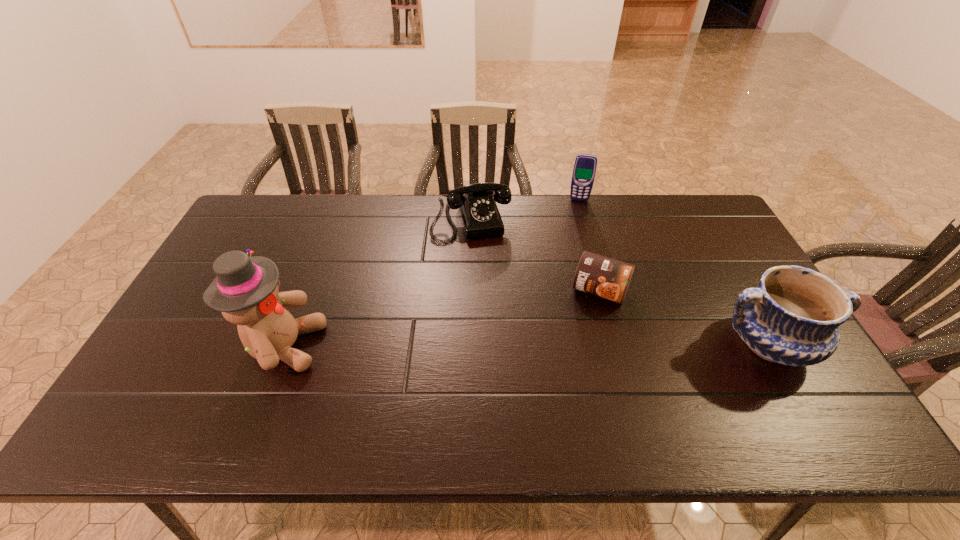
This screenshot has height=540, width=960. What are the coordinates of `free space located 0.100m on the front label of the can` in the screenshot? It's located at (581, 336).

Find the location of `vacant position located on the front label of the can`. vacant position located on the front label of the can is located at coordinates (583, 330).

Find the location of `free location located on the front-facing side of the cellular telephone`. free location located on the front-facing side of the cellular telephone is located at coordinates (573, 237).

Image resolution: width=960 pixels, height=540 pixels. Identify the location of blank area located on the front-facing side of the cellular telephone. coord(572,240).

Image resolution: width=960 pixels, height=540 pixels. I want to click on vacant space located 0.100m on the front-facing side of the cellular telephone, so click(x=575, y=219).

Find the location of a particular element. vacant area situated 0.310m on the dial of the telephone is located at coordinates (498, 317).

The width and height of the screenshot is (960, 540). What are the coordinates of `vacant space located 0.070m on the dial of the telephone` in the screenshot? It's located at (482, 259).

Locate an element on the screen. The height and width of the screenshot is (540, 960). vacant space located 0.080m on the dial of the telephone is located at coordinates (483, 261).

I want to click on cellular telephone that is at the far edge, so click(x=584, y=170).

You are a GUI agent. You are given a task and a screenshot of the screen. Output one action in this format:
    pyautogui.click(x=<x>, y=<y>)
    Task: Click on the telephone located at the far edge
    This screenshot has height=540, width=960.
    Given the screenshot: What is the action you would take?
    pyautogui.click(x=480, y=217)